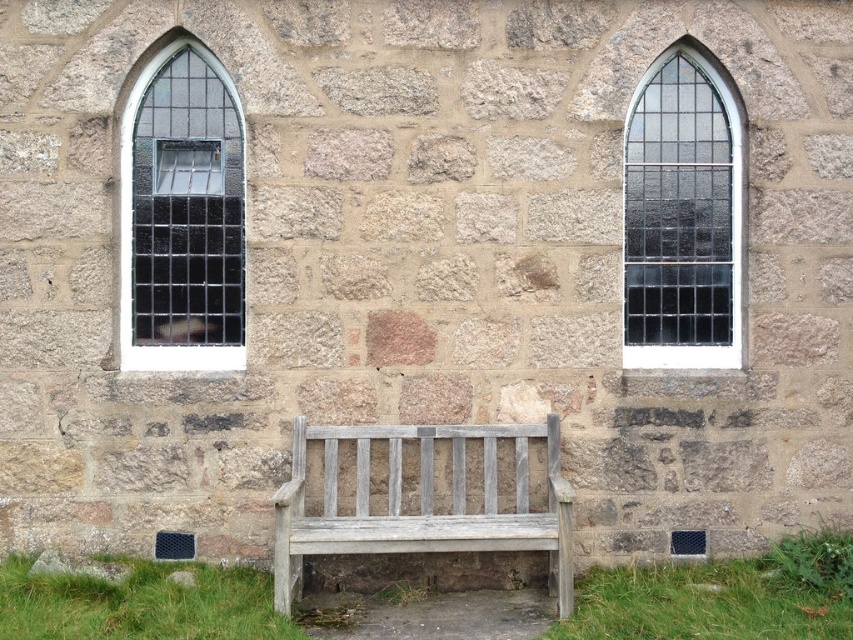
You are a window cleaner standing in front of the stone wall. You need to clean the dark glass window at left and the weathered wood bench at center. Which object requires you to move your cleaning equipment a shorter distance horizontally?

The dark glass window at left has a lesser width compared to the weathered wood bench at center, so you need to move your cleaning equipment a shorter distance horizontally to clean the dark glass window at left.

You are an architect examining the stone wall with two windows. You need to determine which window has a larger width. Which one is wider between the dark glass window at left and the clear glass window at center right?

The dark glass window at left is wider than the clear glass window at center right according to the description.

You are a tourist standing in front of the stone wall with two arched windows. You see the dark glass window at left and the weathered wood bench at center. Which object is positioned to the left of the other?

The dark glass window at left is to the left of the weathered wood bench at center.